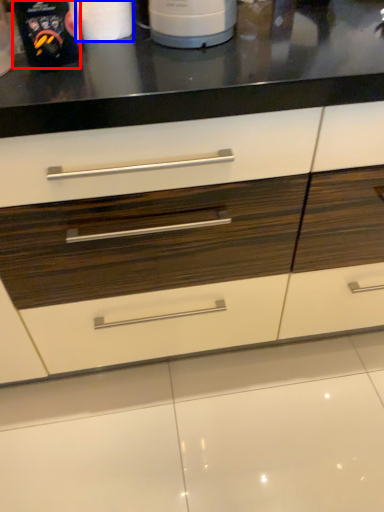
Question: Which point is further to the camera, kitchen appliance (highlighted by a red box) or paper towel (highlighted by a blue box)?

Choices:
 (A) kitchen appliance
 (B) paper towel

Answer: (B)